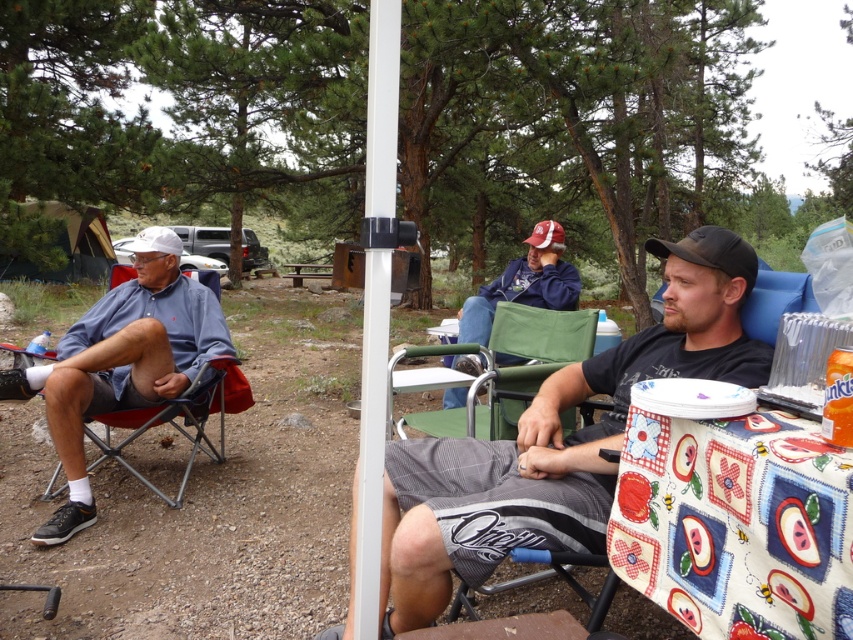
Question: Which of these objects is positioned closest to the matte blue shirt at left?

Choices:
 (A) blue denim jacket at center
 (B) floral cotton tablecloth at lower right
 (C) dark gray shorts at center

Answer: (C)

Question: Where is dark gray shorts at center located in relation to floral cotton tablecloth at lower right in the image?

Choices:
 (A) left
 (B) right

Answer: (A)

Question: Can you confirm if dark gray shorts at center is wider than blue denim jacket at center?

Choices:
 (A) yes
 (B) no

Answer: (A)

Question: Among these objects, which one is nearest to the camera?

Choices:
 (A) dark gray shorts at center
 (B) blue denim jacket at center
 (C) matte blue shirt at left

Answer: (A)

Question: Based on their relative distances, which object is farther from the blue denim jacket at center?

Choices:
 (A) dark gray shorts at center
 (B) green fabric chair at center
 (C) floral cotton tablecloth at lower right
 (D) matte blue shirt at left

Answer: (C)

Question: Can you confirm if matte blue shirt at left is wider than green fabric chair at center?

Choices:
 (A) yes
 (B) no

Answer: (A)